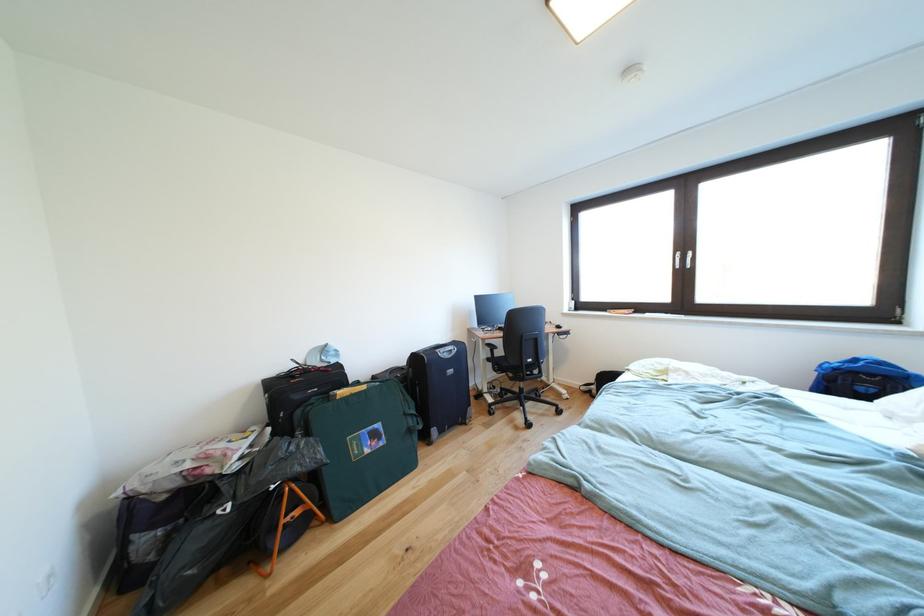
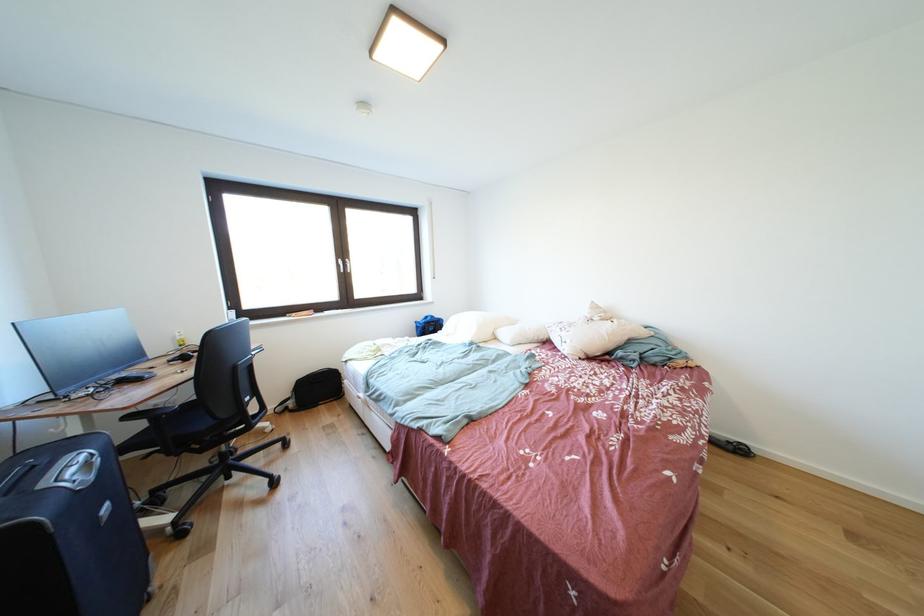
Locate, in the second image, the point that corresponds to (x=602, y=392) in the first image.

(299, 408)